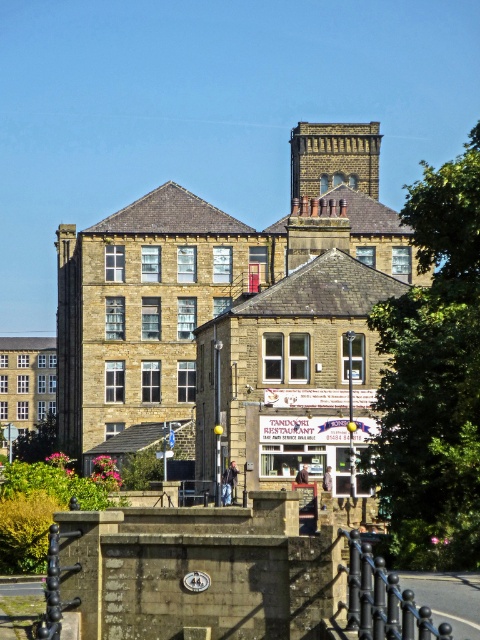
Question: Which object appears closest to the camera in this image?

Choices:
 (A) black metal railing at lower center
 (B) brown stone bell tower at upper center

Answer: (A)

Question: Does black metal railing at lower center have a larger size compared to brown stone bell tower at upper center?

Choices:
 (A) no
 (B) yes

Answer: (A)

Question: Does black metal railing at lower center come behind brown stone bell tower at upper center?

Choices:
 (A) no
 (B) yes

Answer: (A)

Question: Which point is farther to the camera?

Choices:
 (A) brown stone bell tower at upper center
 (B) black metal railing at lower center

Answer: (A)

Question: Can you confirm if black metal railing at lower center is bigger than brown stone bell tower at upper center?

Choices:
 (A) no
 (B) yes

Answer: (A)